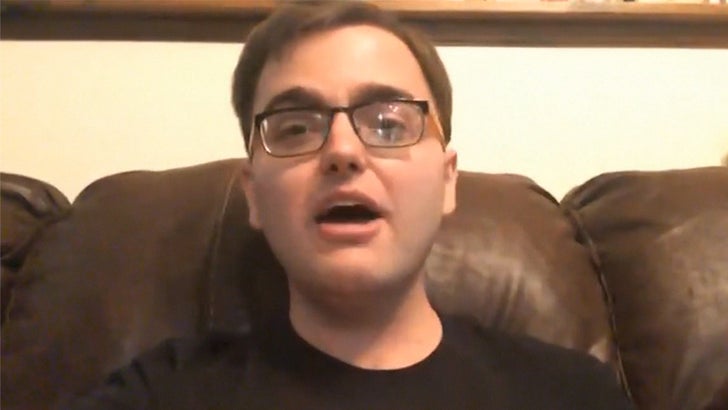
Find the location of `brown trim that is cut out of image`. brown trim that is cut out of image is located at coordinates (592, 14).